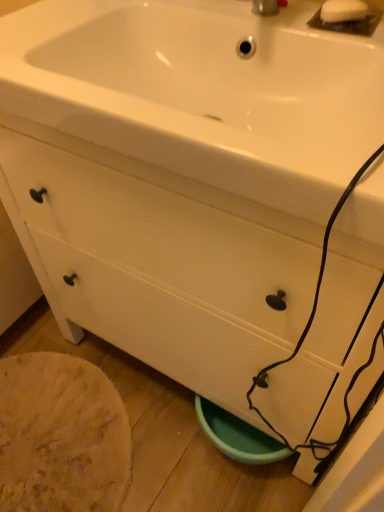
Question: Is white matte soap at upper right spatially inside white glossy sink at upper center, or outside of it?

Choices:
 (A) outside
 (B) inside

Answer: (A)

Question: Is point (367, 6) positioned closer to the camera than point (261, 112)?

Choices:
 (A) farther
 (B) closer

Answer: (B)

Question: Based on their relative distances, which object is farther from the white matte drawer at lower center?

Choices:
 (A) white matte soap at upper right
 (B) white glossy sink at upper center

Answer: (A)

Question: Which is nearer to the white matte drawer at lower center?

Choices:
 (A) white matte soap at upper right
 (B) white glossy sink at upper center

Answer: (B)